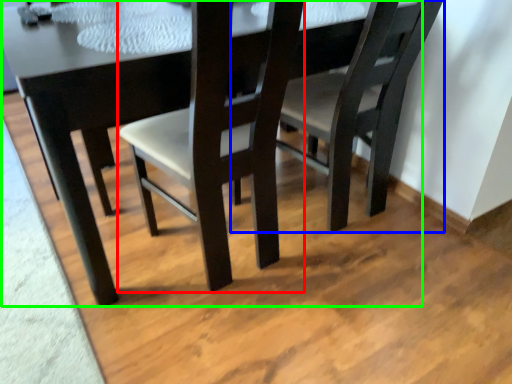
Question: Which is farther away from chair (highlighted by a red box)? chair (highlighted by a blue box) or table (highlighted by a green box)?

Choices:
 (A) chair
 (B) table

Answer: (A)